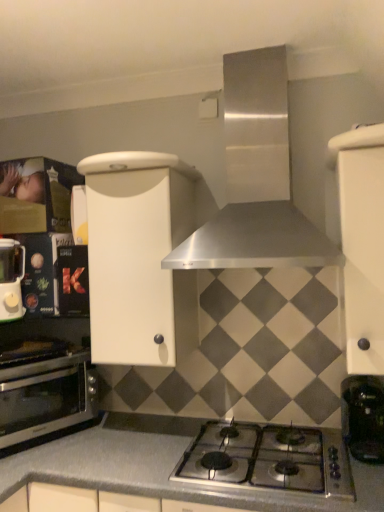
What are the coordinates of `free location above stainless steel range hood at upper center (from a real-world perspective)` in the screenshot? It's located at (240, 30).